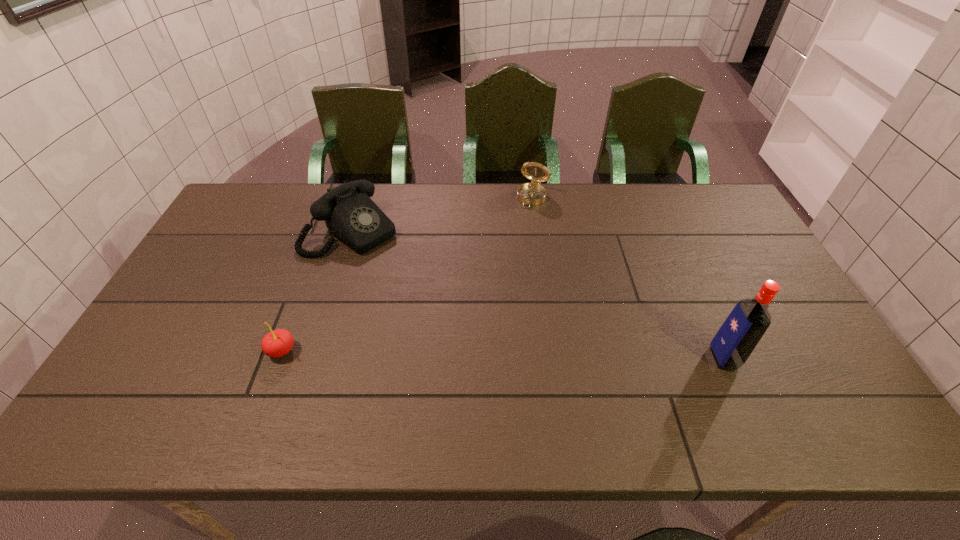
I want to click on cherry, so click(x=277, y=343).

The width and height of the screenshot is (960, 540). Find the location of `the rightmost object`. the rightmost object is located at coordinates (748, 321).

In order to click on vodka in this screenshot , I will do `click(748, 321)`.

The width and height of the screenshot is (960, 540). I want to click on telephone, so click(350, 215).

Identify the location of compass. (533, 193).

Identify the location of free space located 0.140m on the right of the cherry. (352, 351).

Where is `free space located on the front and back of the tallest object`? free space located on the front and back of the tallest object is located at coordinates click(x=772, y=358).

Find the location of a particular element. Image resolution: width=960 pixels, height=540 pixels. free space located 0.260m on the dial of the telephone is located at coordinates (435, 295).

Find the location of a particular element. This screenshot has height=540, width=960. free region located 0.070m on the dial of the telephone is located at coordinates (394, 262).

Where is `vacant position located on the dial of the telephone`? The height and width of the screenshot is (540, 960). vacant position located on the dial of the telephone is located at coordinates (396, 264).